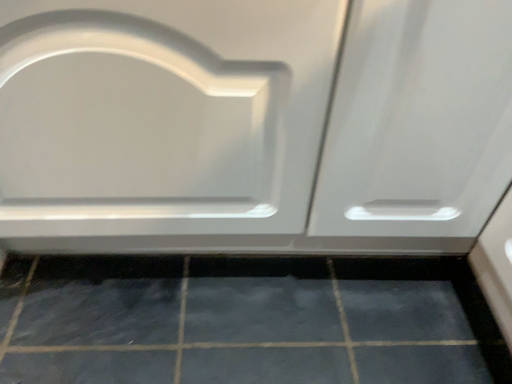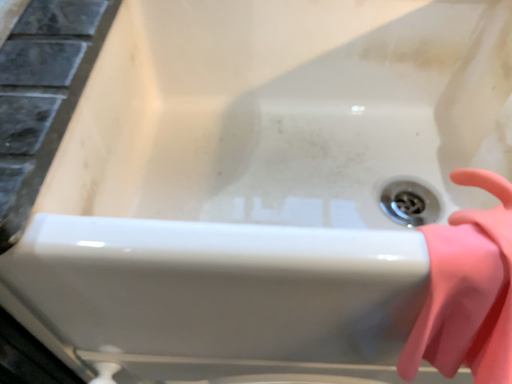
Question: How did the camera likely rotate when shooting the video?

Choices:
 (A) rotated upward
 (B) rotated downward

Answer: (B)